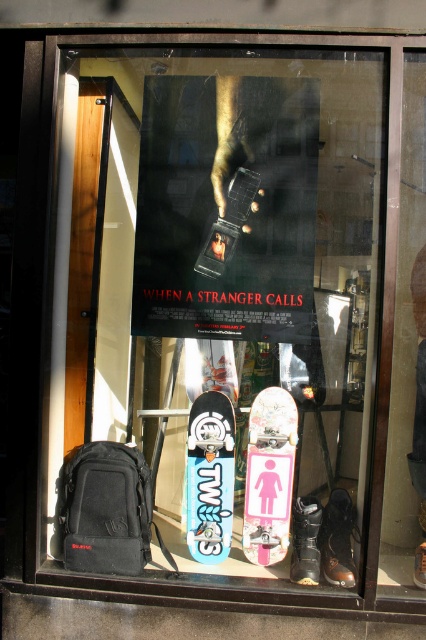
You are a customer looking at the storefront window display. You see the pink glossy skateboard at center and the blue matte skateboard at center. Which one is positioned to the right side?

The pink glossy skateboard at center is positioned to the right of the blue matte skateboard at center.

You are a skateboarder who wants to choose between the pink glossy skateboard at center and the blue matte skateboard at center. Which one is bigger?

The pink glossy skateboard at center is larger in size than the blue matte skateboard at center, so the pink one is bigger.